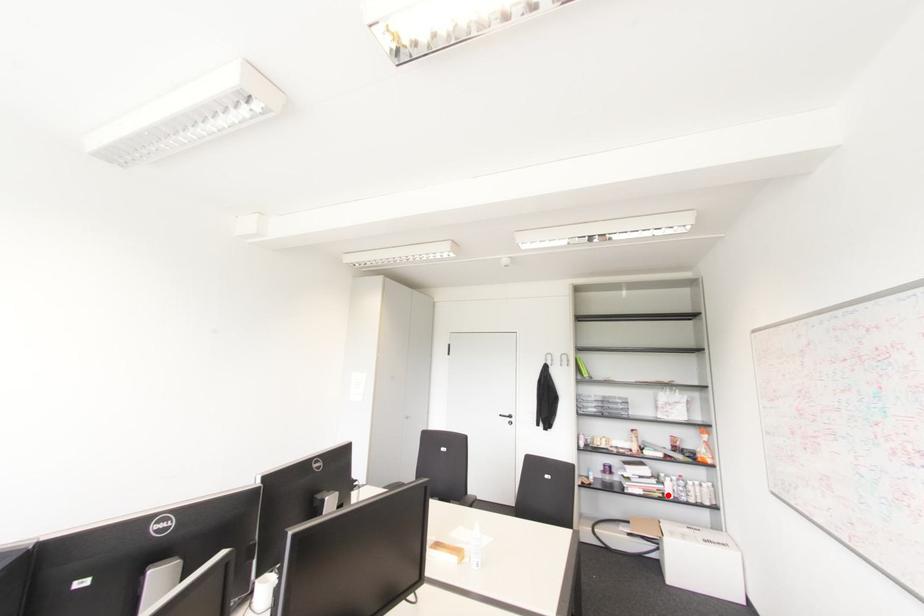
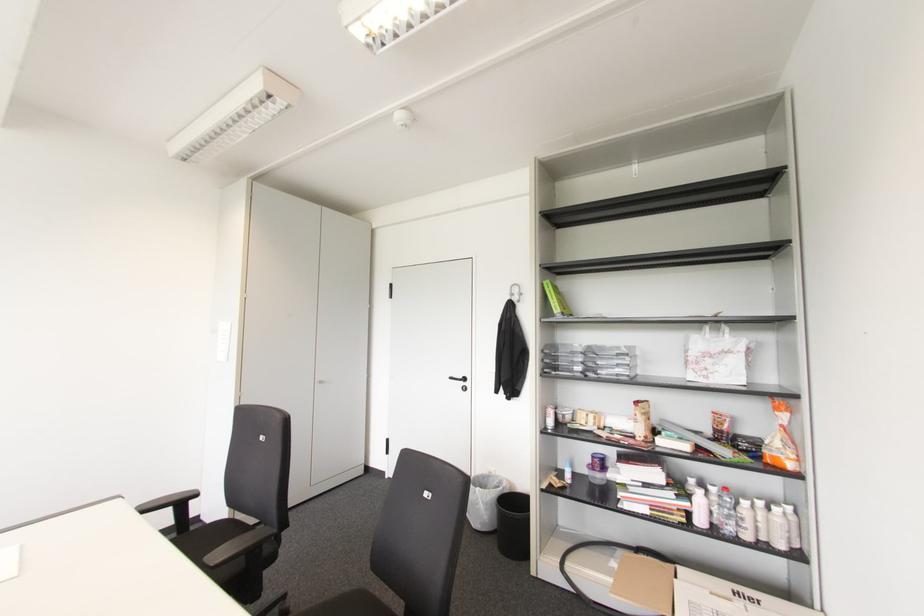
Question: I am providing you with two images of the same scene from different viewpoints. A red point is marked on the first image. Is the red point's position out of view in image 2?

Choices:
 (A) Yes
 (B) No

Answer: (B)